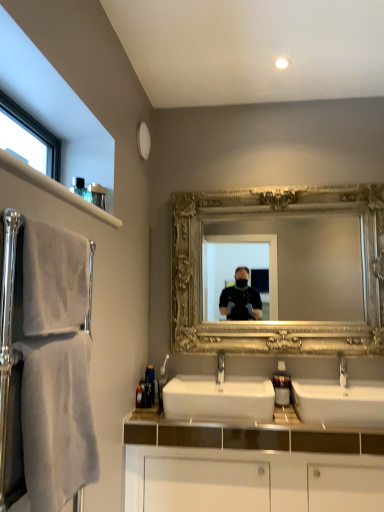
This screenshot has width=384, height=512. What are the coordinates of `vacant area that is situated to the right of silver metallic faucet at center` in the screenshot? It's located at (367, 394).